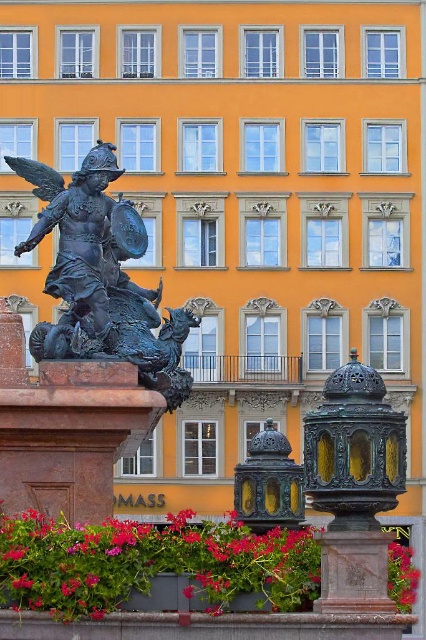
Which of these two, vivid pink petals at lower center or bronze statue at left, stands shorter?

Standing shorter between the two is bronze statue at left.

Is vivid pink petals at lower center wider than bronze statue at left?

Yes.

Is point (218, 580) in front of point (39, 189)?

That is True.

Image resolution: width=426 pixels, height=640 pixels. I want to click on vivid pink petals at lower center, so click(x=152, y=564).

Which is more to the left, bronze statue at left or vivid red petals at lower right?

bronze statue at left is more to the left.

What do you see at coordinates (101, 276) in the screenshot? I see `bronze statue at left` at bounding box center [101, 276].

Find the location of a particular element. This screenshot has height=640, width=426. bronze statue at left is located at coordinates (101, 276).

This screenshot has width=426, height=640. I want to click on vivid pink petals at lower center, so click(152, 564).

Can you confirm if vivid pink petals at lower center is shorter than vivid red petals at lower right?

Incorrect, vivid pink petals at lower center's height does not fall short of vivid red petals at lower right's.

Between point (397, 593) and point (412, 604), which one is positioned in front?

Point (397, 593)

The image size is (426, 640). Find the location of `vivid pink petals at lower center`. vivid pink petals at lower center is located at coordinates (152, 564).